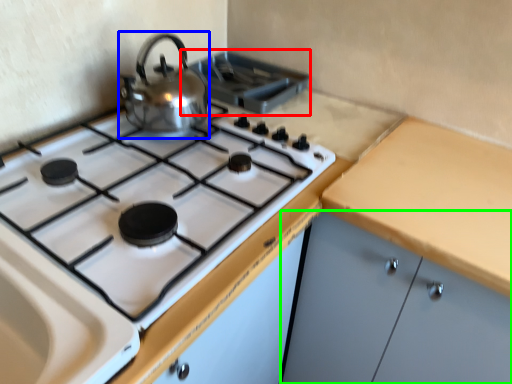
Question: Which object is positioned farthest from appliance (highlighted by a red box)? Select from kitchen appliance (highlighted by a blue box) and cabinetry (highlighted by a green box).

Choices:
 (A) kitchen appliance
 (B) cabinetry

Answer: (B)